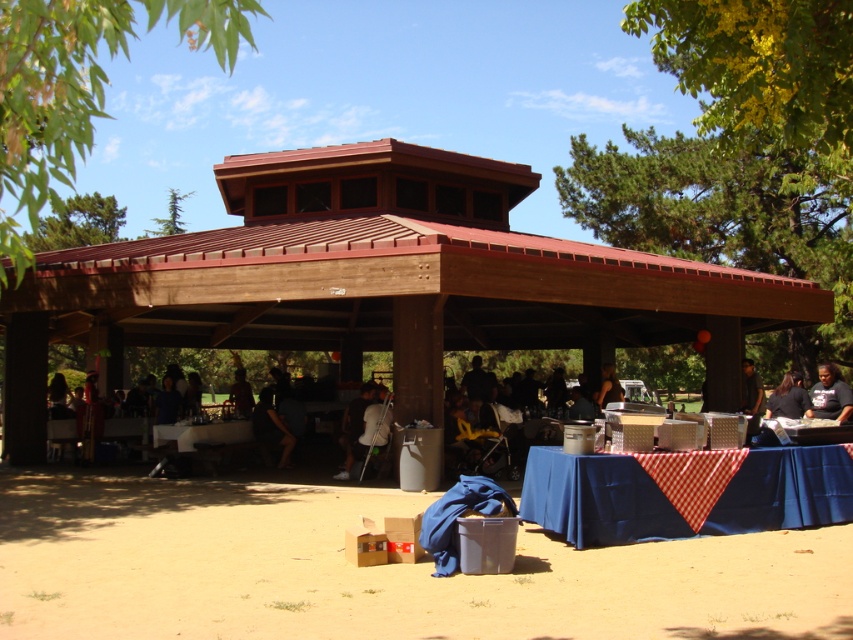
Question: Does black fabric at center appear on the left side of green coniferous tree at upper left?

Choices:
 (A) yes
 (B) no

Answer: (B)

Question: Is blue fabric table at lower right above black fabric at center?

Choices:
 (A) yes
 (B) no

Answer: (B)

Question: Which object is farther from the camera taking this photo?

Choices:
 (A) dark blue shirt at center
 (B) black cotton shirt at center
 (C) dark gray fabric chair at center
 (D) white plastic table at center

Answer: (A)

Question: Considering the relative positions of dark blue shirt at center and dark gray fabric at lower right in the image provided, where is dark blue shirt at center located with respect to dark gray fabric at lower right?

Choices:
 (A) right
 (B) left

Answer: (B)

Question: Considering the real-world distances, which object is farthest from the green leafy tree at upper left?

Choices:
 (A) green coniferous tree at upper left
 (B) brown sandy dirt at lower center
 (C) dark blue shirt at center
 (D) dark brown hair at center

Answer: (A)

Question: Which of the following is the farthest from the observer?

Choices:
 (A) dark gray fabric at lower right
 (B) brown sandy dirt at lower center
 (C) dark blue shirt at center

Answer: (A)